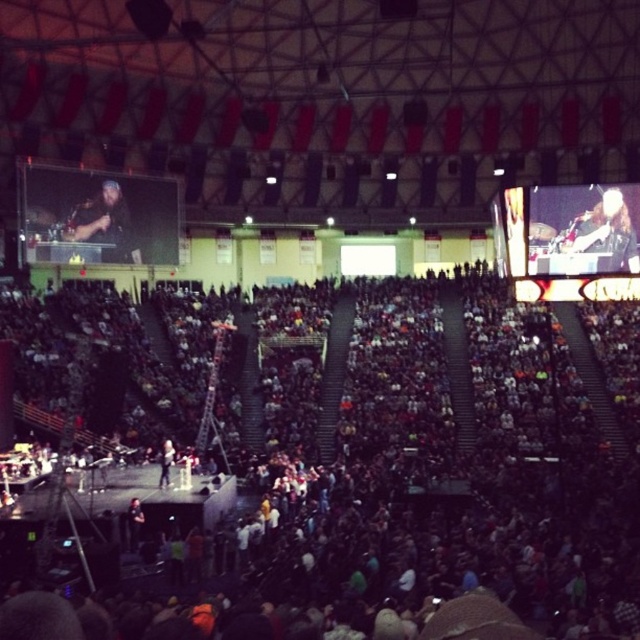
Question: Among these points, which one is farthest from the camera?

Choices:
 (A) (49, 257)
 (B) (106, 208)

Answer: (B)

Question: Is shiny silver guitar at upper right below bearded man with microphone at upper left?

Choices:
 (A) no
 (B) yes

Answer: (B)

Question: Which point is farther from the camera taking this photo?

Choices:
 (A) (170, 458)
 (B) (330, 525)

Answer: (A)

Question: Does matte black screen at upper left have a smaller size compared to bearded man with microphone at upper left?

Choices:
 (A) yes
 (B) no

Answer: (B)

Question: Which point is closer to the camera?

Choices:
 (A) bearded man with microphone at upper left
 (B) dark gray crowd at center
 (C) light brown leather jacket at center
 (D) matte black screen at upper left

Answer: (B)

Question: Can you confirm if matte black screen at upper left is bigger than light brown leather jacket at center?

Choices:
 (A) yes
 (B) no

Answer: (A)